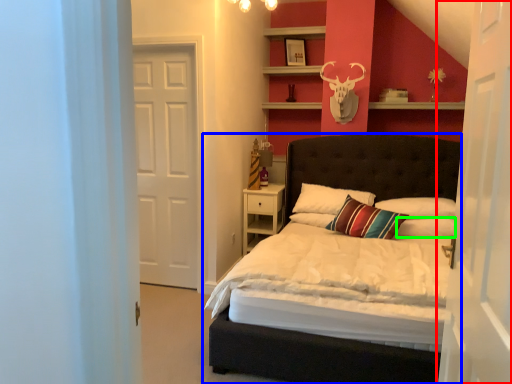
Question: Which object is the closest to the door (highlighted by a red box)? Choose among these: bed (highlighted by a blue box) or pillow (highlighted by a green box).

Choices:
 (A) bed
 (B) pillow

Answer: (B)